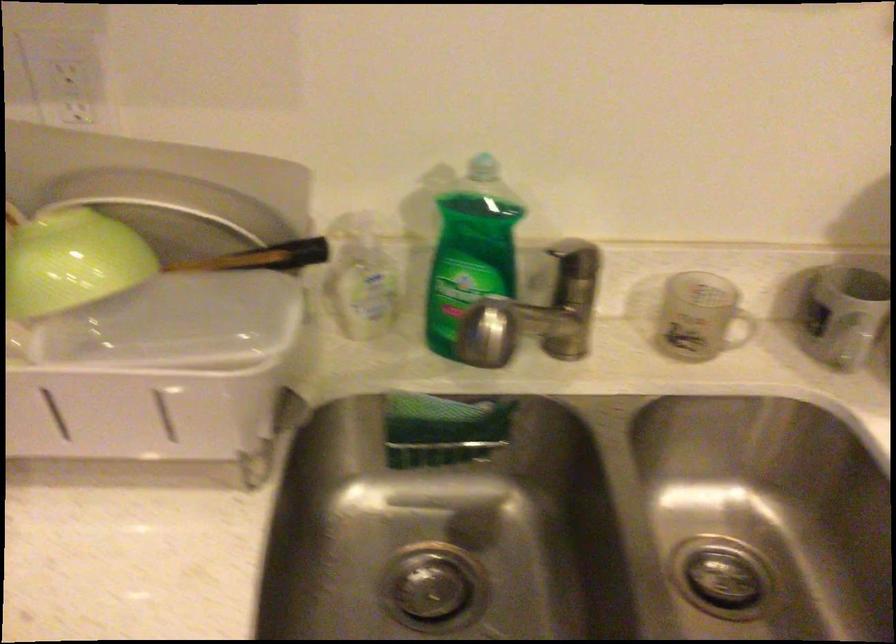
The image size is (896, 644). What do you see at coordinates (279, 258) in the screenshot? I see `the utensil handle` at bounding box center [279, 258].